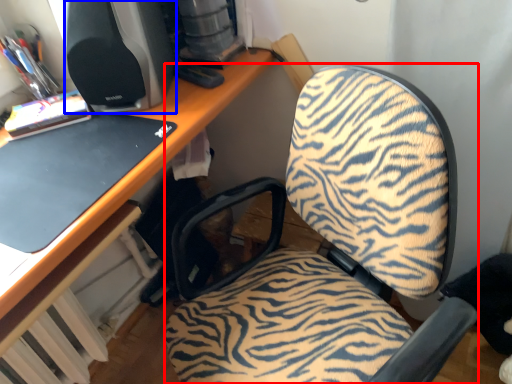
Question: Which point is closer to the camera, furniture (highlighted by a red box) or desktop computer (highlighted by a blue box)?

Choices:
 (A) furniture
 (B) desktop computer

Answer: (A)